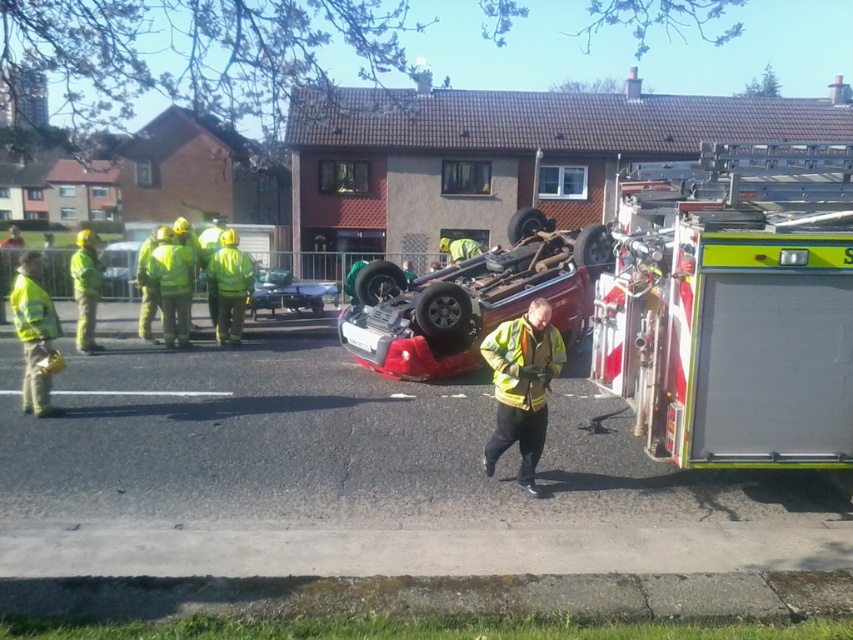
You are a pedestrian standing at the edge of the scene. You see the high visibility reflective jacket at center and the metallic silver car at center. Which object is wider?

The metallic silver car at center is wider than the high visibility reflective jacket at center.